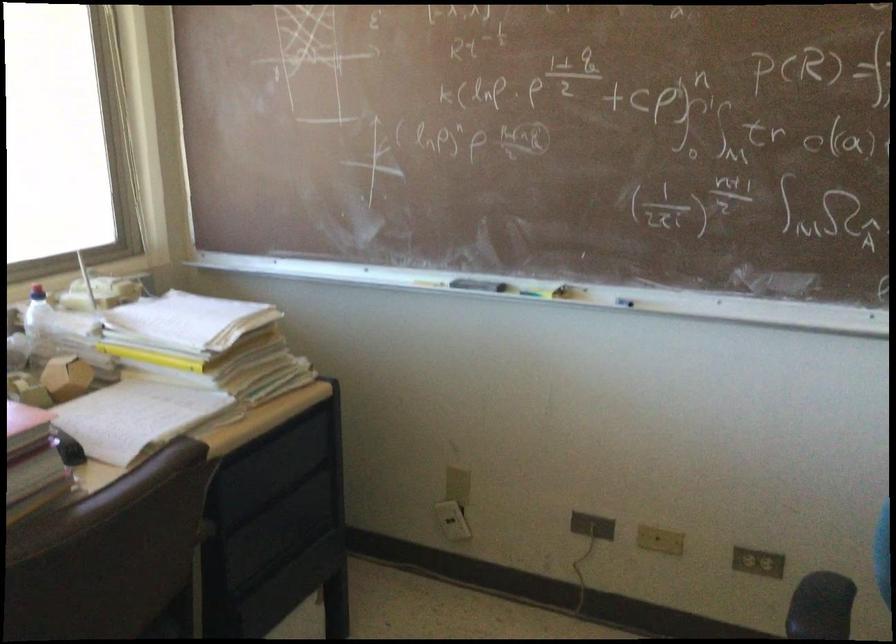
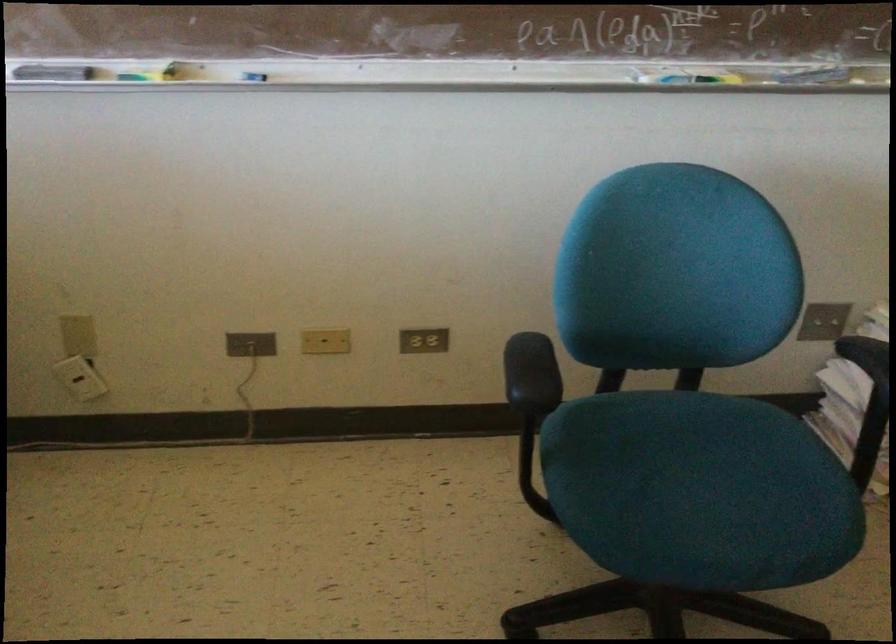
In the second image, find the point that corresponds to (481,286) in the first image.

(53, 73)